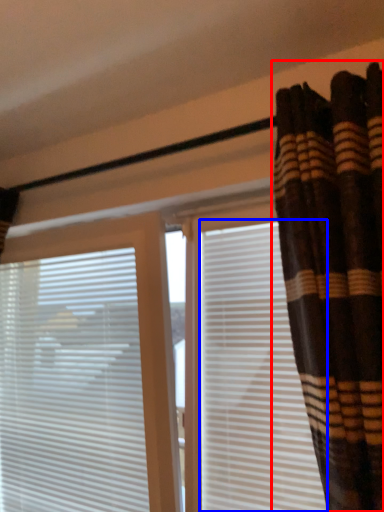
Question: Among these objects, which one is farthest to the camera, curtain (highlighted by a red box) or shutter (highlighted by a blue box)?

Choices:
 (A) curtain
 (B) shutter

Answer: (B)